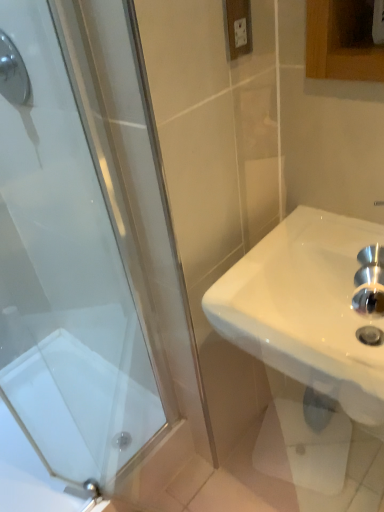
Question: Is white plastic electric outlet at upper center facing towards shiny chrome showerhead at upper left?

Choices:
 (A) no
 (B) yes

Answer: (A)

Question: Is white plastic electric outlet at upper center wider than shiny chrome showerhead at upper left?

Choices:
 (A) no
 (B) yes

Answer: (A)

Question: Does white plastic electric outlet at upper center have a lesser height compared to shiny chrome showerhead at upper left?

Choices:
 (A) no
 (B) yes

Answer: (B)

Question: Can you confirm if white plastic electric outlet at upper center is smaller than shiny chrome showerhead at upper left?

Choices:
 (A) yes
 (B) no

Answer: (A)

Question: From the image's perspective, is white plastic electric outlet at upper center below shiny chrome showerhead at upper left?

Choices:
 (A) yes
 (B) no

Answer: (B)

Question: From a real-world perspective, is shiny chrome showerhead at upper left physically located above or below white glossy sink at right?

Choices:
 (A) below
 (B) above

Answer: (B)

Question: From the image's perspective, is shiny chrome showerhead at upper left positioned above or below white glossy sink at right?

Choices:
 (A) above
 (B) below

Answer: (A)

Question: In terms of width, does shiny chrome showerhead at upper left look wider or thinner when compared to white glossy sink at right?

Choices:
 (A) wide
 (B) thin

Answer: (B)

Question: Considering their positions, is shiny chrome showerhead at upper left located in front of or behind white glossy sink at right?

Choices:
 (A) front
 (B) behind

Answer: (B)

Question: Choose the correct answer: Is white glossy sink at right inside white glossy bath at lower left or outside it?

Choices:
 (A) outside
 (B) inside

Answer: (A)

Question: From the image's perspective, is white glossy sink at right above or below white glossy bath at lower left?

Choices:
 (A) below
 (B) above

Answer: (B)

Question: Considering the positions of white glossy sink at right and white glossy bath at lower left in the image, is white glossy sink at right taller or shorter than white glossy bath at lower left?

Choices:
 (A) tall
 (B) short

Answer: (A)

Question: Does point (279, 260) appear closer or farther from the camera than point (102, 470)?

Choices:
 (A) farther
 (B) closer

Answer: (B)

Question: Is point (228, 327) positioned closer to the camera than point (235, 30)?

Choices:
 (A) farther
 (B) closer

Answer: (A)

Question: Is white glossy sink at right inside or outside of white plastic electric outlet at upper center?

Choices:
 (A) outside
 (B) inside

Answer: (A)